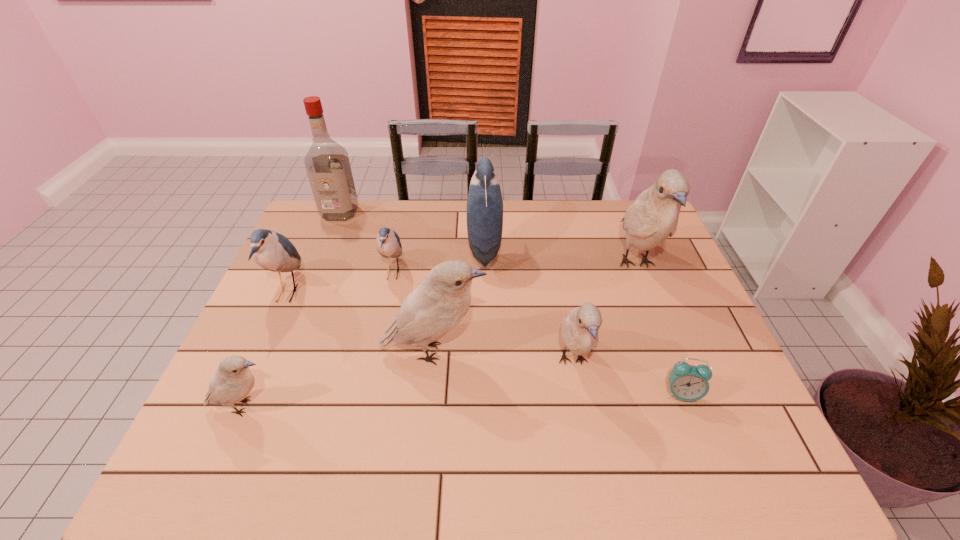
Locate an element on the screen. The image size is (960, 540). the shortest object is located at coordinates (687, 382).

You are a GUI agent. You are given a task and a screenshot of the screen. Output one action in this format:
    pyautogui.click(x=<x>, y=<y>)
    Task: Click on the vacant space located 0.290m on the front-facing side of the farthest object
    The image size is (960, 540).
    Given the screenshot: What is the action you would take?
    pyautogui.click(x=313, y=280)

The image size is (960, 540). Find the location of `vacant point located 0.080m at the beak of the rightmost bird`. vacant point located 0.080m at the beak of the rightmost bird is located at coordinates click(x=659, y=323).

At what (x,y) coordinates should I click in order to perform the action: click on blank space located at the tip of the biggest blue bird's beak. Please return your answer as a coordinate pair (x, y). The image size is (960, 540). Looking at the image, I should click on (362, 249).

Image resolution: width=960 pixels, height=540 pixels. I want to click on vacant space situated at the tip of the biggest blue bird's beak, so click(x=418, y=249).

Find the location of a particular element. This screenshot has height=540, width=960. vacant space located 0.400m at the tip of the biggest blue bird's beak is located at coordinates tap(344, 249).

At what (x,y) coordinates should I click in order to perform the action: click on vacant region located at the beak of the third smallest white bird. Please return your answer as a coordinate pair (x, y). This screenshot has height=540, width=960. Looking at the image, I should click on (572, 352).

At what (x,y) coordinates should I click in order to perform the action: click on vacant space situated at the tip of the leftmost blue bird's beak. Please return your answer as a coordinate pair (x, y). This screenshot has width=960, height=540. Looking at the image, I should click on pos(340,292).

The image size is (960, 540). In order to click on blank space located at the beak of the third white bird from left to right in this screenshot , I will do `click(591, 462)`.

Where is `vacant region located at the tip of the second blue bird from left to right's beak`? Image resolution: width=960 pixels, height=540 pixels. vacant region located at the tip of the second blue bird from left to right's beak is located at coordinates (479, 273).